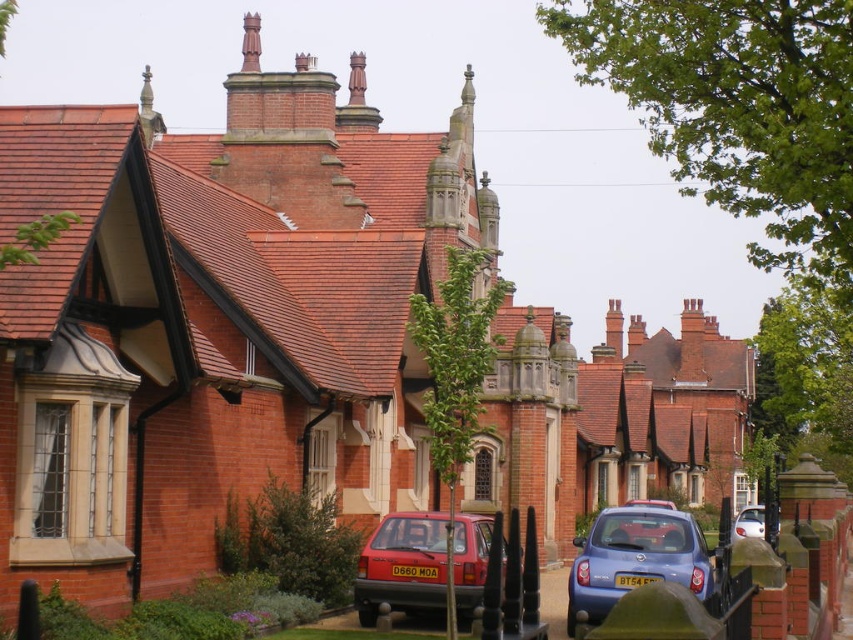
Is point (480, 545) less distant than point (654, 500)?

That is True.

Between matte red hatchback at center and matte red car at center, which one is positioned higher?

matte red hatchback at center is higher up.

The width and height of the screenshot is (853, 640). What do you see at coordinates (402, 564) in the screenshot?
I see `matte red hatchback at center` at bounding box center [402, 564].

I want to click on matte red hatchback at center, so click(402, 564).

From the picture: Which is more to the left, matte red hatchback at center or white glossy car at lower right?

Positioned to the left is matte red hatchback at center.

Describe the element at coordinates (402, 564) in the screenshot. Image resolution: width=853 pixels, height=640 pixels. I see `matte red hatchback at center` at that location.

The width and height of the screenshot is (853, 640). Identify the location of matte red hatchback at center. (402, 564).

Is matte red hatchback at center to the left of metallic blue hatchback at lower right from the viewer's perspective?

Yes, matte red hatchback at center is to the left of metallic blue hatchback at lower right.

Which is behind, point (404, 531) or point (602, 596)?

The point (404, 531) is more distant.

Find the location of a particular element. This screenshot has width=853, height=640. matte red hatchback at center is located at coordinates (402, 564).